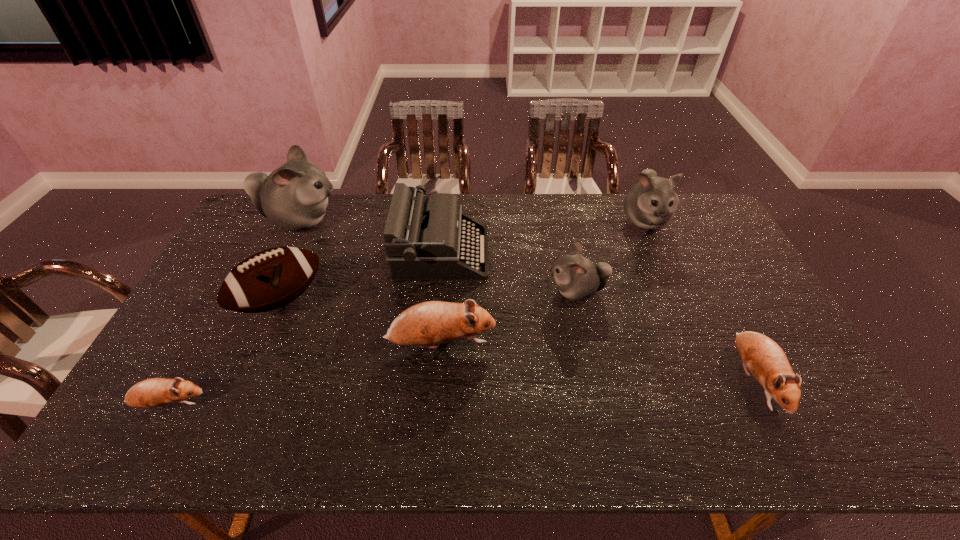
Identify the location of vacant space located on the face of the fourth nearest hamster. The height and width of the screenshot is (540, 960). coord(469,291).

The image size is (960, 540). What are the coordinates of `blank space located at the face of the second brown hamster from left to right` in the screenshot? It's located at (546, 345).

The width and height of the screenshot is (960, 540). Find the location of `vacant space located at the face of the seventh tallest object`. vacant space located at the face of the seventh tallest object is located at coordinates (786, 444).

Identify the location of vacant area located at the face of the shortest hamster. (357, 404).

This screenshot has height=540, width=960. Find the location of `typewriter that is at the far edge`. typewriter that is at the far edge is located at coordinates (423, 241).

You are a GUI agent. You are given a task and a screenshot of the screen. Output one action in this format:
    pyautogui.click(x=<x>, y=<y>)
    Task: Click on the object that is at the near edge
    This screenshot has width=960, height=540.
    Given the screenshot: What is the action you would take?
    pyautogui.click(x=767, y=362)

Where is `football (American) that is at the left edge`? The height and width of the screenshot is (540, 960). football (American) that is at the left edge is located at coordinates (x=270, y=279).

I want to click on object located at the right edge, so click(767, 362).

Locate an element on the screen. This screenshot has width=960, height=540. object that is positioned at the far left corner is located at coordinates (294, 197).

The image size is (960, 540). What are the coordinates of `object at the near right corner` in the screenshot? It's located at (767, 362).